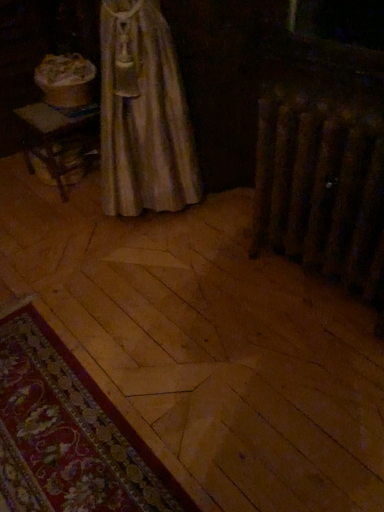
Question: Is floral carpet at lower left shorter than rusty metal radiator at right?

Choices:
 (A) yes
 (B) no

Answer: (A)

Question: From a real-world perspective, is floral carpet at lower left under rusty metal radiator at right?

Choices:
 (A) yes
 (B) no

Answer: (A)

Question: Is floral carpet at lower left oriented towards rusty metal radiator at right?

Choices:
 (A) yes
 (B) no

Answer: (B)

Question: Is rusty metal radiator at right completely or partially inside floral carpet at lower left?

Choices:
 (A) yes
 (B) no

Answer: (B)

Question: Is floral carpet at lower left thinner than rusty metal radiator at right?

Choices:
 (A) no
 (B) yes

Answer: (A)

Question: Is floral carpet at lower left to the left of rusty metal radiator at right from the viewer's perspective?

Choices:
 (A) no
 (B) yes

Answer: (B)

Question: Is rusty metal radiator at right not near floral carpet at lower left?

Choices:
 (A) no
 (B) yes

Answer: (A)

Question: Does rusty metal radiator at right appear on the right side of floral carpet at lower left?

Choices:
 (A) yes
 (B) no

Answer: (A)

Question: Does rusty metal radiator at right have a smaller size compared to floral carpet at lower left?

Choices:
 (A) no
 (B) yes

Answer: (A)

Question: Can you confirm if rusty metal radiator at right is bigger than floral carpet at lower left?

Choices:
 (A) yes
 (B) no

Answer: (A)

Question: Does rusty metal radiator at right have a lesser width compared to floral carpet at lower left?

Choices:
 (A) no
 (B) yes

Answer: (B)

Question: Does rusty metal radiator at right contain floral carpet at lower left?

Choices:
 (A) yes
 (B) no

Answer: (B)

Question: Relative to rusty metal radiator at right, is floral carpet at lower left in front or behind?

Choices:
 (A) front
 (B) behind

Answer: (A)